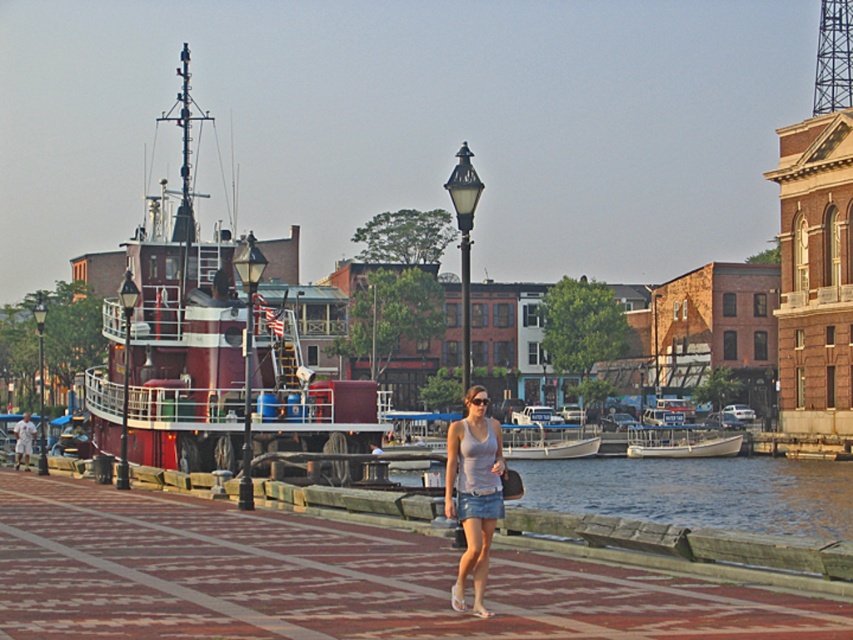
Question: Which point appears closest to the camera in this image?

Choices:
 (A) (257, 516)
 (B) (476, 180)
 (C) (39, 376)
 (D) (648, 456)

Answer: (B)

Question: Can you confirm if denim shorts at center is positioned below matte black lamp post at center?

Choices:
 (A) no
 (B) yes

Answer: (B)

Question: Among these points, which one is farthest from the camera?

Choices:
 (A) (44, 429)
 (B) (241, 253)
 (C) (461, 461)

Answer: (A)

Question: Does matte black lamp post at center have a smaller size compared to white fiberglass boat at center?

Choices:
 (A) yes
 (B) no

Answer: (B)

Question: Can you confirm if wooden boat at center is bigger than black glass lamp post at left?

Choices:
 (A) no
 (B) yes

Answer: (A)

Question: Which of these objects is positioned farthest from the red polished wood boat at left?

Choices:
 (A) wooden boat at center
 (B) smooth wooden dock at center
 (C) white fiberglass boat at center

Answer: (A)